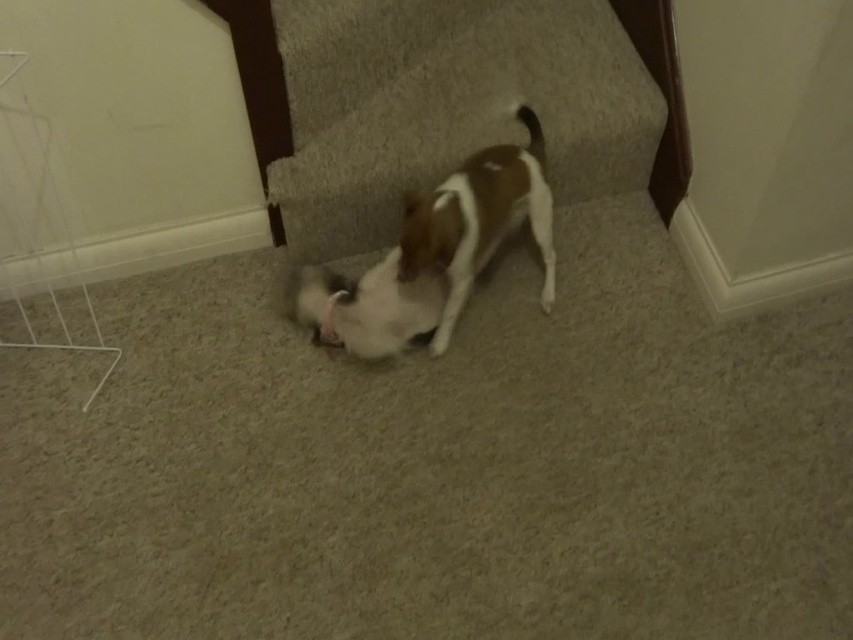
Between brown and white fur dog at center and white fur dog at center, which one is positioned higher?

brown and white fur dog at center is above.

Does brown and white fur dog at center have a smaller size compared to white fur dog at center?

No, brown and white fur dog at center is not smaller than white fur dog at center.

Identify the location of brown and white fur dog at center. (479, 220).

Which is above, carpeted stair at lower center or brown and white fur dog at center?

carpeted stair at lower center is above.

Identify the location of carpeted stair at lower center. The width and height of the screenshot is (853, 640). (448, 104).

Find the location of a particular element. Image resolution: width=853 pixels, height=640 pixels. carpeted stair at lower center is located at coordinates (448, 104).

Can you confirm if carpeted stair at lower center is wider than white fur dog at center?

Indeed, carpeted stair at lower center has a greater width compared to white fur dog at center.

Between carpeted stair at lower center and white fur dog at center, which one appears on the right side from the viewer's perspective?

From the viewer's perspective, carpeted stair at lower center appears more on the right side.

This screenshot has width=853, height=640. What are the coordinates of `carpeted stair at lower center` in the screenshot? It's located at (448, 104).